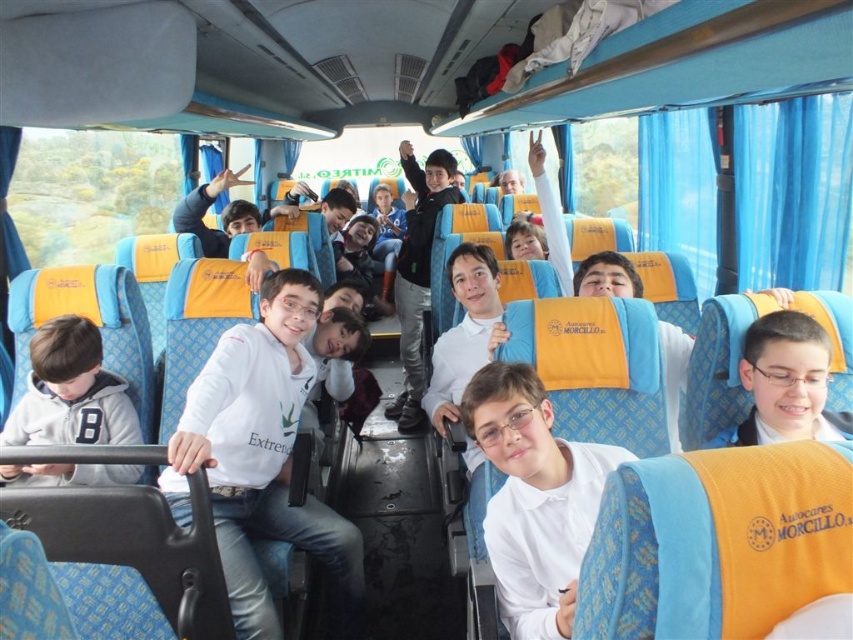
Consider the image. Does white matte shirt at center come in front of gray fleece jacket at lower left?

That is True.

Measure the distance from white matte shirt at center to gray fleece jacket at lower left.

A distance of 52.74 centimeters exists between white matte shirt at center and gray fleece jacket at lower left.

The image size is (853, 640). Find the location of `white matte shirt at center`. white matte shirt at center is located at coordinates (262, 458).

Find the location of `white matte shirt at center`. white matte shirt at center is located at coordinates (262, 458).

Based on the photo, who is more distant from viewer, [550,589] or [817,360]?

Positioned behind is point [817,360].

Identify the location of white glossy shirt at center. The width and height of the screenshot is (853, 640). 534,499.

Find the location of a particular element. The width and height of the screenshot is (853, 640). white glossy shirt at center is located at coordinates (534, 499).

Which is in front, point (119, 388) or point (434, 157)?

Point (119, 388) is more forward.

What are the coordinates of `gray fleece jacket at lower left` in the screenshot? It's located at (70, 392).

Which is behind, point (57, 470) or point (421, 364)?

The point (421, 364) is behind.

Where is `gray fleece jacket at lower left`? This screenshot has height=640, width=853. gray fleece jacket at lower left is located at coordinates (70, 392).